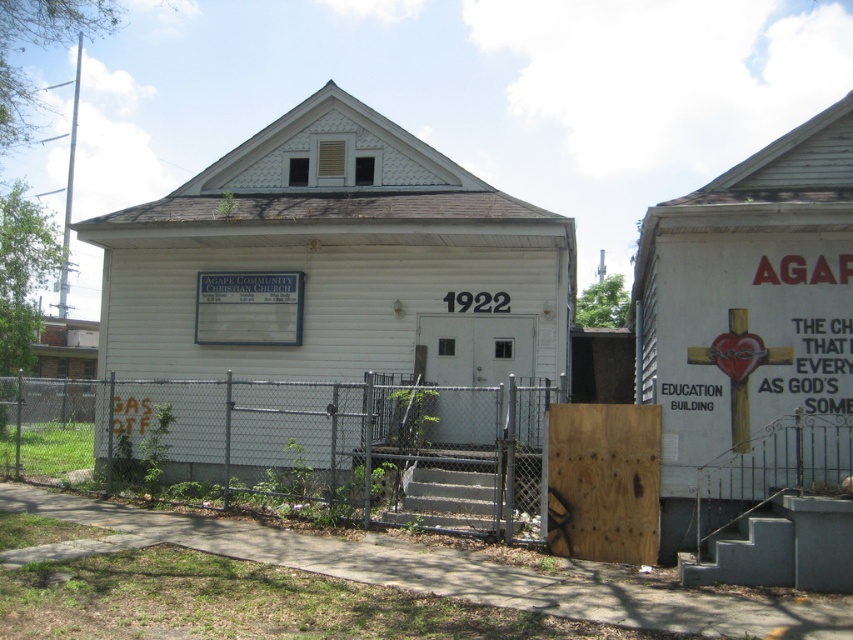
You are standing at the entrance of the Agape Community Christian Church. You need to read the text on the white matte sign at center. Can you read it clearly from your current position?

The white matte sign at center is 14.66 meters away from the viewer. Since the distance is quite far, it might be difficult to read the text clearly without moving closer.